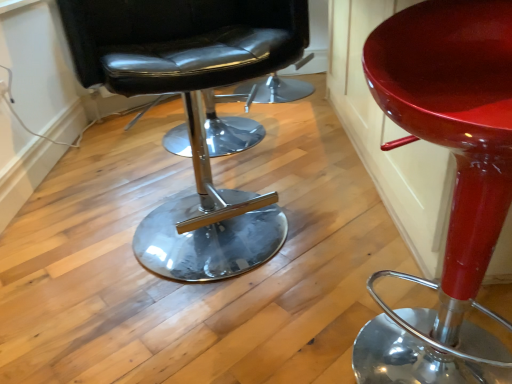
I want to click on vacant space behind glossy red stool at center, acting as the 1th chair starting from the right, so click(x=362, y=274).